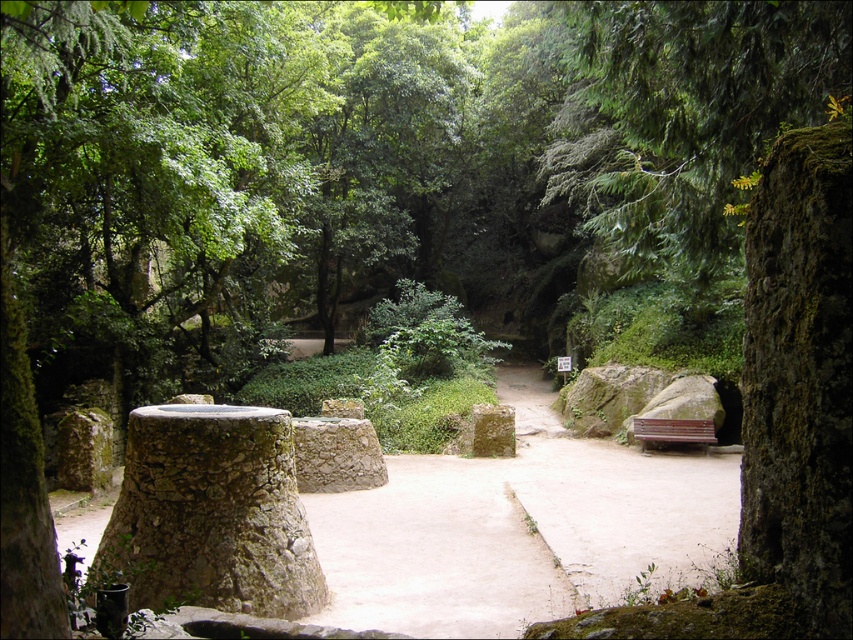
Between point (368, 490) and point (497, 445), which one is positioned in front?

Point (368, 490)

Does smooth stone path at center come in front of green mossy stone at center?

Yes, smooth stone path at center is in front of green mossy stone at center.

Where is `smooth stone path at center`? smooth stone path at center is located at coordinates (517, 528).

Locate an element on the screen. The width and height of the screenshot is (853, 640). smooth stone path at center is located at coordinates (517, 528).